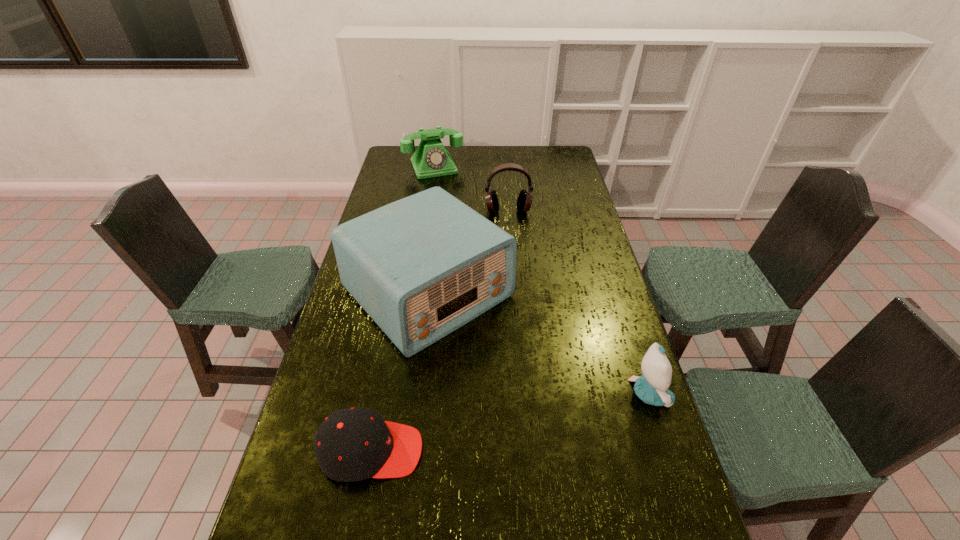
You are a GUI agent. You are given a task and a screenshot of the screen. Output one action in this format:
    pyautogui.click(x=<x>, y=<y>)
    Task: Click on the free space on the desktop that is between the nearest object and the second shortest object and is positioned on the front panel of the radio receiver
    
    Given the screenshot: What is the action you would take?
    pyautogui.click(x=558, y=413)

Where is `vacant space on the desktop that is between the cap and the kitten and is positioned on the dial of the farthest object`? The width and height of the screenshot is (960, 540). vacant space on the desktop that is between the cap and the kitten and is positioned on the dial of the farthest object is located at coordinates tap(546, 415).

Identify the location of vacant spot on the desktop that is between the cap and the kitten and is positioned on the ear pads of the second farthest object. (532, 418).